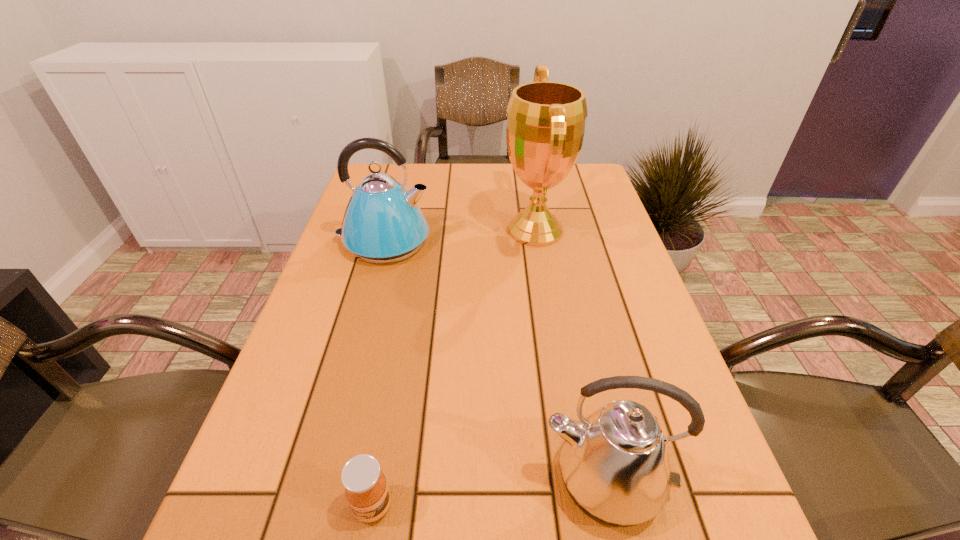
This screenshot has width=960, height=540. What are the coordinates of `award` in the screenshot? It's located at (545, 128).

Where is `the farther kettle`? the farther kettle is located at coordinates (383, 223).

The height and width of the screenshot is (540, 960). I want to click on the right kettle, so click(x=615, y=465).

Locate an element on the screen. This screenshot has width=960, height=540. honey is located at coordinates (366, 489).

In order to click on free space located on the front-facing side of the tallest object in this screenshot , I will do `click(455, 231)`.

Locate an element on the screen. vacant region located 0.300m on the front-facing side of the tallest object is located at coordinates (395, 231).

At what (x,y) coordinates should I click in order to perform the action: click on vacant space located 0.270m on the front-facing side of the tallest object. Please return your answer as a coordinate pair (x, y). Looking at the image, I should click on (405, 231).

The height and width of the screenshot is (540, 960). I want to click on free region located at the spout of the left kettle, so click(x=457, y=241).

In order to click on blank space located on the left of the nearer kettle in this screenshot , I will do `click(293, 480)`.

Identify the location of object located in the far edge section of the desktop. (545, 128).